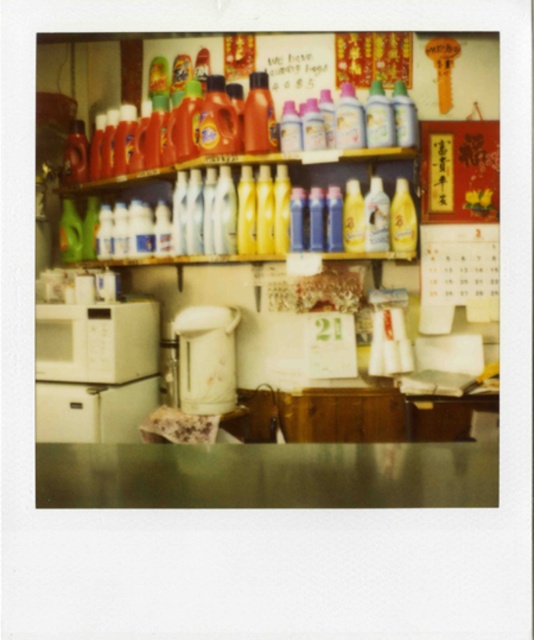
Who is shorter, matte plastic bottles at upper center or white glossy electric kettle at center?

With less height is white glossy electric kettle at center.

Who is more distant from viewer, (x=387, y=480) or (x=185, y=358)?

The point (x=185, y=358) is behind.

Which is behind, point (224, 209) or point (197, 340)?

The point (197, 340) is behind.

At what (x,y) coordinates should I click in order to perform the action: click on matte plastic bottles at upper center. Please return your answer as a coordinate pair (x, y). The width and height of the screenshot is (534, 640). Looking at the image, I should click on (268, 296).

Does white glossy electric kettle at center appear over translucent plastic bottles at upper center?

No.

Does point (227, 337) lie in front of point (282, 157)?

No, it is behind (282, 157).

Locate an element on the screen. The image size is (534, 640). white glossy electric kettle at center is located at coordinates (206, 358).

This screenshot has width=534, height=640. What do you see at coordinates (97, 340) in the screenshot?
I see `white matte microwave at lower left` at bounding box center [97, 340].

Is white matte microwave at lower left wider than translucent plastic bottles at upper center?

In fact, white matte microwave at lower left might be narrower than translucent plastic bottles at upper center.

Is point (122, 320) positioned behind point (339, 150)?

That is True.

Identify the location of white matte microwave at lower left. (97, 340).